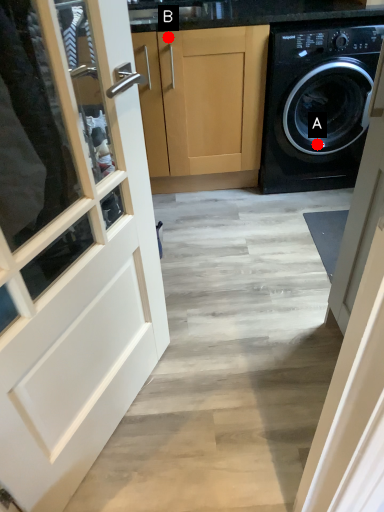
Question: Two points are circled on the image, labeled by A and B beside each circle. Which point appears closest to the camera in this image?

Choices:
 (A) A is closer
 (B) B is closer

Answer: (B)